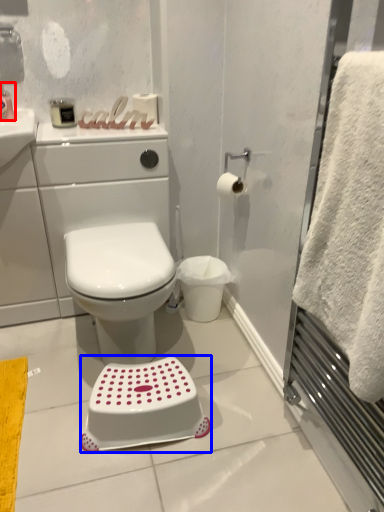
Question: Among these objects, which one is nearest to the camera, toiletry (highlighted by a red box) or step stool (highlighted by a blue box)?

Choices:
 (A) toiletry
 (B) step stool

Answer: (B)